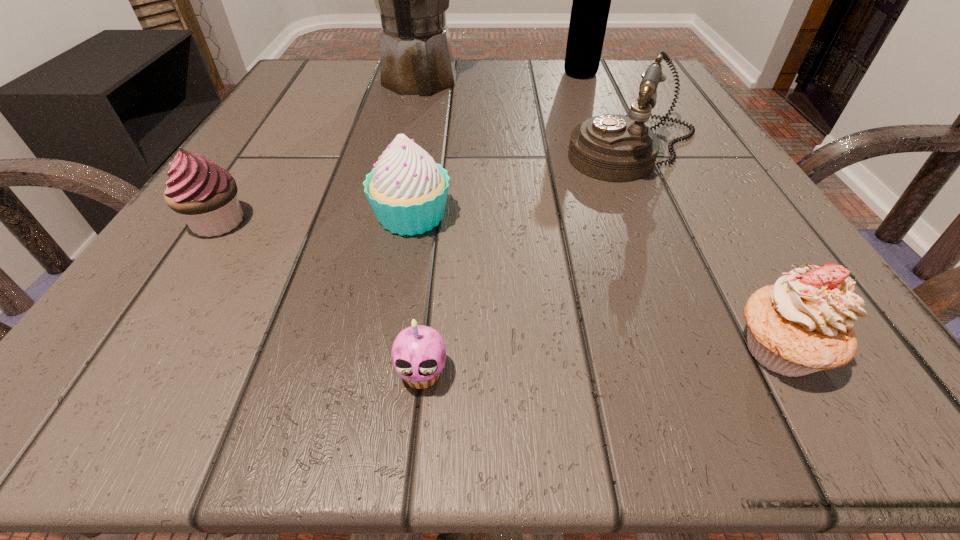
Locate an element on the screen. This screenshot has height=540, width=960. coffeepot positioned at the far edge is located at coordinates (416, 56).

Locate an element on the screen. beer bottle at the far edge is located at coordinates (590, 9).

Identify the location of object present at the left edge. (205, 194).

What are the coordinates of `beer bottle situated at the right edge` in the screenshot? It's located at (590, 9).

The width and height of the screenshot is (960, 540). Identify the location of telephone that is at the right edge. (616, 148).

The height and width of the screenshot is (540, 960). What are the coordinates of `cupcake that is at the right edge` in the screenshot? It's located at (802, 324).

Where is `object located in the far right corner section of the desktop`? object located in the far right corner section of the desktop is located at coordinates (590, 9).

Locate an element on the screen. This screenshot has width=960, height=540. object present at the near right corner is located at coordinates (802, 324).

You are a GUI agent. You are given a task and a screenshot of the screen. Output one action in this format:
    pyautogui.click(x=<x>, y=<y>)
    Task: Click on the vacant space at the far edge
    The width and height of the screenshot is (960, 540).
    Given the screenshot: What is the action you would take?
    pyautogui.click(x=488, y=104)

The width and height of the screenshot is (960, 540). In the image, there is a desktop. In order to click on vacant space at the near edge in this screenshot , I will do `click(567, 330)`.